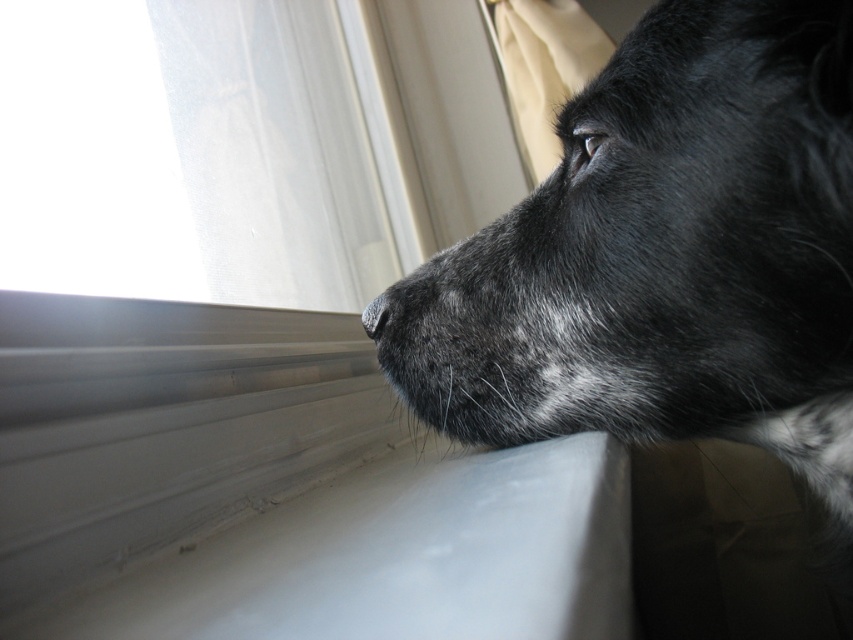
Question: Does transparent fabric at upper left appear on the left side of black matte nose at center?

Choices:
 (A) no
 (B) yes

Answer: (B)

Question: Which of the following is the closest to the observer?

Choices:
 (A) (367, 308)
 (B) (813, 296)

Answer: (B)

Question: Which object is closer to the camera taking this photo?

Choices:
 (A) transparent fabric at upper left
 (B) black matte nose at center
 (C) black fur dog at upper right

Answer: (C)

Question: Considering the relative positions of transparent fabric at upper left and black matte nose at center in the image provided, where is transparent fabric at upper left located with respect to black matte nose at center?

Choices:
 (A) below
 (B) above

Answer: (B)

Question: Can you confirm if black fur dog at upper right is positioned to the left of transparent fabric at upper left?

Choices:
 (A) yes
 (B) no

Answer: (B)

Question: Which point is closer to the camera?

Choices:
 (A) tap(538, 394)
 (B) tap(389, 317)

Answer: (A)